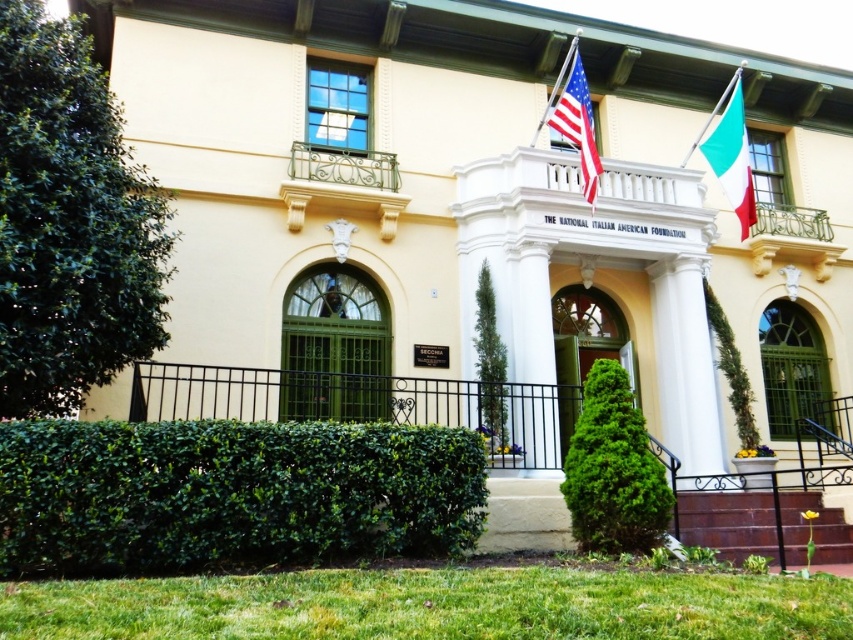
Question: Among these points, which one is farthest from the camera?

Choices:
 (A) (723, 97)
 (B) (344, 422)
 (C) (570, 122)
 (D) (500, 401)

Answer: (A)

Question: Can you confirm if green leafy hedge at lower left is bigger than matte white flag at center?

Choices:
 (A) no
 (B) yes

Answer: (B)

Question: Is green leafy hedge at left closer to the viewer compared to matte white flag at center?

Choices:
 (A) no
 (B) yes

Answer: (B)

Question: Where is green leafy hedge at lower left located in relation to green textured hedge at center in the image?

Choices:
 (A) below
 (B) above

Answer: (A)

Question: Which of the following is the farthest from the observer?

Choices:
 (A) coord(622,499)
 (B) coord(692,520)

Answer: (B)

Question: Which of the following is the closest to the observer?

Choices:
 (A) green leafy bush at center
 (B) brown wooden stairs at lower right
 (C) green leafy hedge at lower left
 (D) green wrought iron balustrade at upper center

Answer: (C)